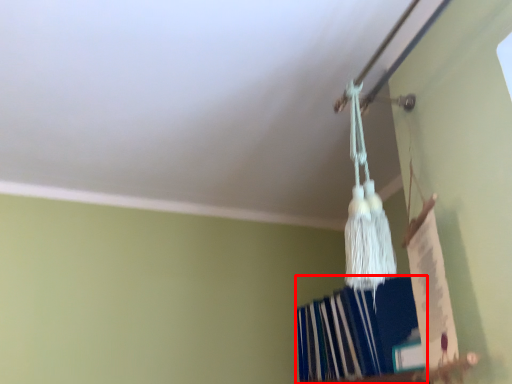
Question: From the image's perspective, where is book (annotated by the red box) located relative to trim?

Choices:
 (A) above
 (B) below

Answer: (B)